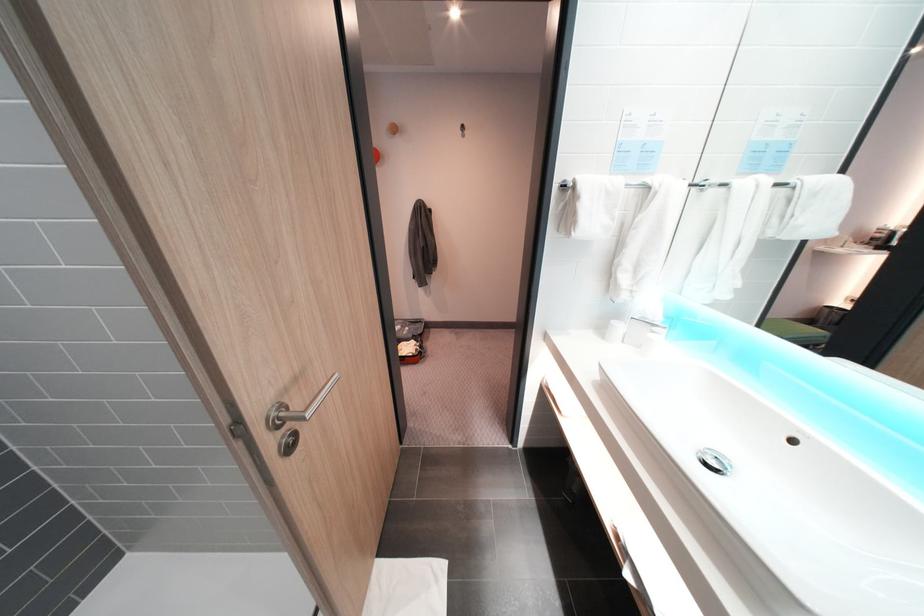
Find where to hang the orange wall hook. Please return your answer as a coordinate pair (x, y).

(392, 129)